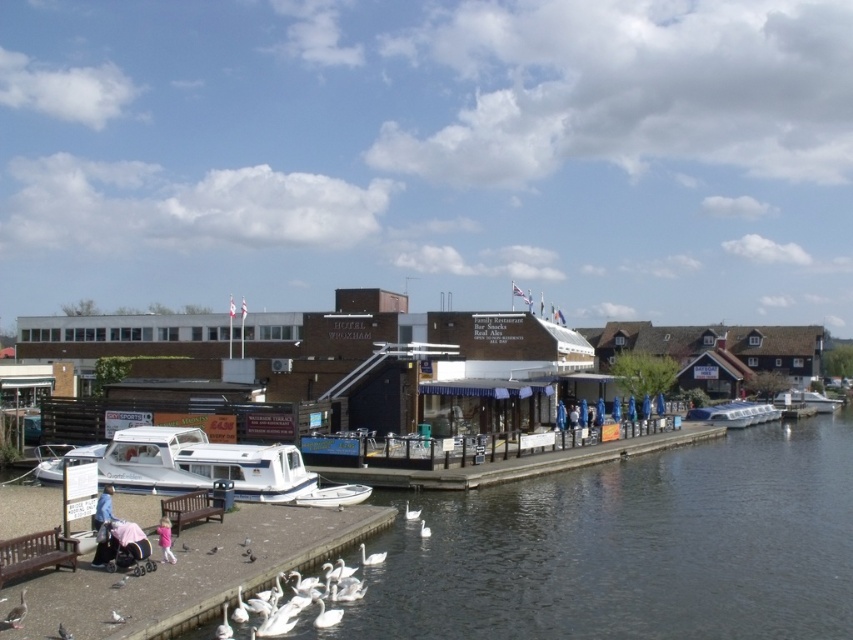
You are standing on the walkway and want to get a clear view of the white plastic boat at center without obstructing the view of the clear water at dock center. Which object should you position yourself closer to?

You should position yourself closer to the clear water at dock center because it is in front of the white plastic boat at center, so moving closer to it would allow you to see both without obstruction.

You are a photographer standing on the riverbank and want to take a photo of the white glossy boat at lower left without the brown wooden bench at lower left blocking the view. Can you adjust your position to achieve this?

The white glossy boat at lower left is positioned over the brown wooden bench at lower left, so you can move your position slightly to the right to ensure the bench is no longer in the frame behind the boat.